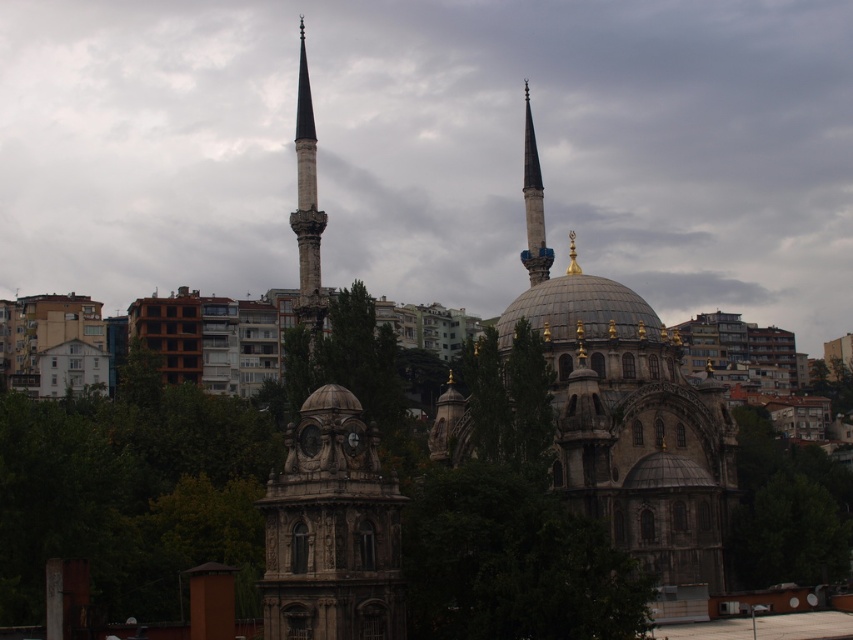
Based on the photo, you are standing in front of the grand mosque and want to take a photo that includes both the point at coordinates point (556,588) and the point at coordinates point (744,433). Which point should be closer to the camera to ensure both are in focus?

Point (556,588) is in front of point (744,433), so to ensure both are in focus, the camera should be positioned closer to point (556,588).

You are standing in front of the grand mosque and want to take a photo that includes both the green leafy tree at lower right and the central dome. Given that the tree is 92.83 meters away from you, will you need to zoom in or out to ensure both are visible in the frame?

The green leafy tree at lower right is 92.83 meters from the viewer. To include both the tree and the central dome in the photo, you would need to zoom out to capture the broader scene, ensuring both distant objects are within the frame.

You are standing at the entrance of the mosque and want to walk to the green leafy tree at lower right. There is a green leafy tree at center blocking your path. Can you walk around it to reach your destination?

The green leafy tree at center is 77.76 feet away from the green leafy tree at lower right, so you can walk around the green leafy tree at center to reach the green leafy tree at lower right.